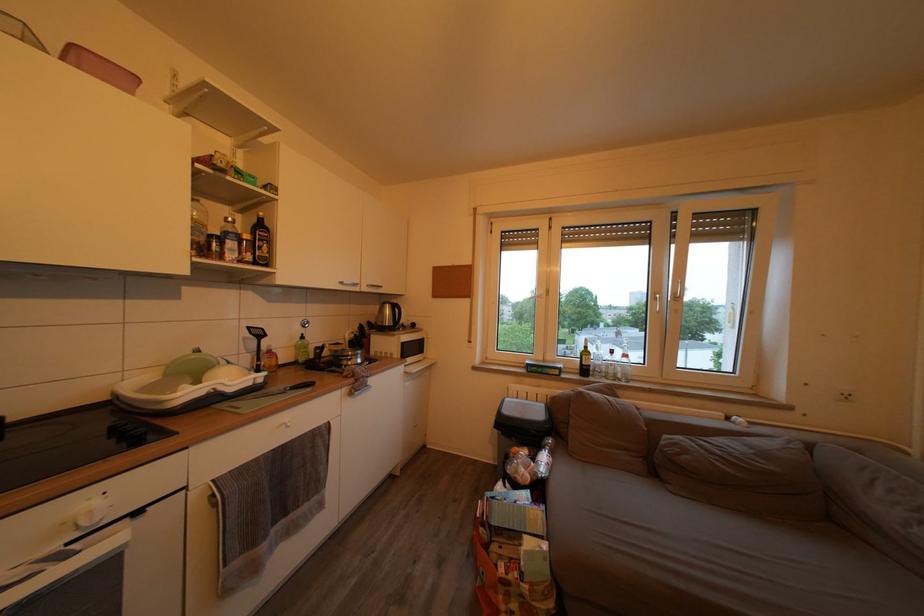
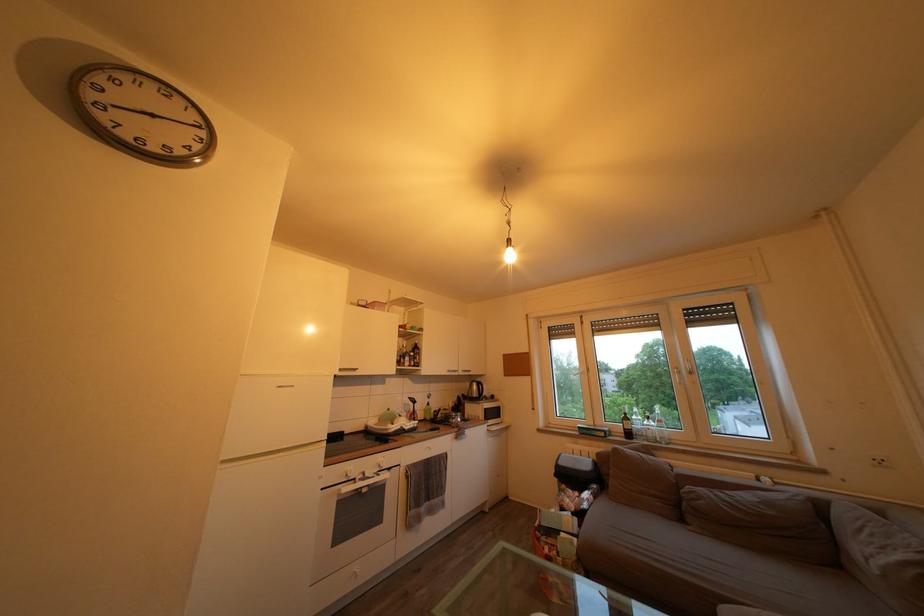
Where in the second image is the point corresponding to the point at 407,375 from the first image?

(492, 434)